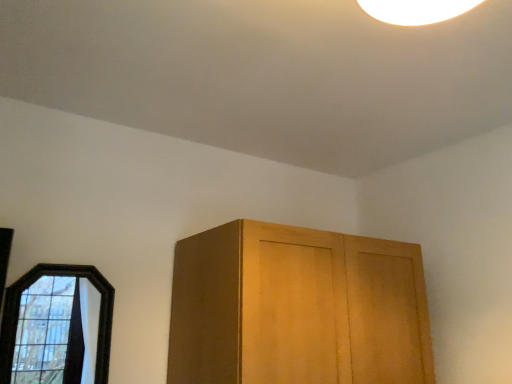
The width and height of the screenshot is (512, 384). Describe the element at coordinates (58, 275) in the screenshot. I see `black glass window at lower left` at that location.

This screenshot has width=512, height=384. I want to click on black glass window at lower left, so pyautogui.click(x=58, y=275).

Where is `black glass window at lower left`? The width and height of the screenshot is (512, 384). black glass window at lower left is located at coordinates (58, 275).